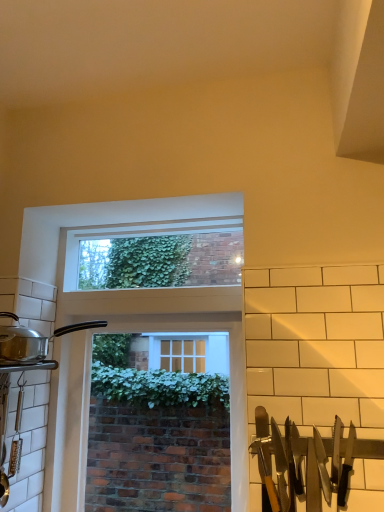
What do you see at coordinates (161, 260) in the screenshot? This screenshot has width=384, height=512. I see `clear glass window at upper center, acting as the 2th window screen starting from the bottom` at bounding box center [161, 260].

Identify the location of clear glass window at center, the 2th window screen viewed from the top. (155, 433).

You are a GUI agent. You are given a task and a screenshot of the screen. Output one action in this format:
    pyautogui.click(x=<x>, y=<y>)
    Task: Click on the silver/black handles at right
    The image size is (384, 512).
    Given the screenshot: What is the action you would take?
    pyautogui.click(x=301, y=463)

Find the location of a particular element. This screenshot has height=512, width=384. silver metallic pot at left is located at coordinates (33, 342).

What are the coordinates of `clear glass window at upper center, which appears as the 1th window screen when viewed from the top` in the screenshot? It's located at (161, 260).

Between clear glass window at upper center, acting as the 2th window screen starting from the bottom, and silver/black handles at right, which one is positioned in front?

Positioned in front is silver/black handles at right.

From a real-world perspective, which object stands above the other?

From a 3D spatial view, clear glass window at upper center, acting as the 2th window screen starting from the bottom, is above.

Considering the sizes of objects clear glass window at upper center, which appears as the 1th window screen when viewed from the top, and silver/black handles at right in the image provided, who is wider, clear glass window at upper center, which appears as the 1th window screen when viewed from the top, or silver/black handles at right?

Wider between the two is clear glass window at upper center, which appears as the 1th window screen when viewed from the top.

Which is more to the left, silver/black handles at right or silver metallic pot at left?

From the viewer's perspective, silver metallic pot at left appears more on the left side.

Is silver/black handles at right taller than silver metallic pot at left?

Correct, silver/black handles at right is much taller as silver metallic pot at left.

Could you tell me if silver/black handles at right is turned towards silver metallic pot at left?

No, silver/black handles at right is not turned towards silver metallic pot at left.

How different are the orientations of clear glass window at center, the first window screen from the bottom, and silver metallic pot at left in degrees?

91.3 degrees.

Does point (135, 509) appear closer or farther from the camera than point (42, 354)?

Point (135, 509) is farther from the camera than point (42, 354).

From the picture: Considering the sizes of objects clear glass window at center, the 2th window screen viewed from the top, and silver metallic pot at left in the image provided, who is shorter, clear glass window at center, the 2th window screen viewed from the top, or silver metallic pot at left?

silver metallic pot at left.

Does clear glass window at center, the 2th window screen viewed from the top, turn towards silver metallic pot at left?

Yes, clear glass window at center, the 2th window screen viewed from the top, is facing silver metallic pot at left.

Is silver metallic pot at left wider than silver/black handles at right?

Correct, the width of silver metallic pot at left exceeds that of silver/black handles at right.

Is silver metallic pot at left bigger than silver/black handles at right?

Yes, silver metallic pot at left is bigger than silver/black handles at right.

From the image's perspective, is silver metallic pot at left located above silver/black handles at right?

Yes.

Considering the points (5, 343) and (337, 450), which point is in front, point (5, 343) or point (337, 450)?

The point (337, 450) is in front.

How different are the orientations of silver/black handles at right and clear glass window at center, the 2th window screen viewed from the top, in degrees?

1.38 degrees.

Consider the image. Is silver/black handles at right shorter than clear glass window at center, the first window screen from the bottom?

Yes, silver/black handles at right is shorter than clear glass window at center, the first window screen from the bottom.

Could you tell me if silver/black handles at right is turned towards clear glass window at center, the first window screen from the bottom?

No, silver/black handles at right is not facing towards clear glass window at center, the first window screen from the bottom.

Considering the sizes of objects silver/black handles at right and clear glass window at center, the first window screen from the bottom, in the image provided, who is bigger, silver/black handles at right or clear glass window at center, the first window screen from the bottom,?

Bigger between the two is clear glass window at center, the first window screen from the bottom.

Is clear glass window at center, the first window screen from the bottom, further to camera compared to clear glass window at upper center, which appears as the 1th window screen when viewed from the top?

No, it is not.

Is clear glass window at upper center, acting as the 2th window screen starting from the bottom, inside clear glass window at center, the first window screen from the bottom?

No, clear glass window at center, the first window screen from the bottom, does not contain clear glass window at upper center, acting as the 2th window screen starting from the bottom.

Based on their positions, is clear glass window at center, the 2th window screen viewed from the top, located to the left or right of clear glass window at upper center, acting as the 2th window screen starting from the bottom?

clear glass window at center, the 2th window screen viewed from the top, is to the right of clear glass window at upper center, acting as the 2th window screen starting from the bottom.

Considering the points (187, 441) and (226, 248), which point is behind, point (187, 441) or point (226, 248)?

The point (187, 441) is farther from the camera.

Can you confirm if silver metallic pot at left is wider than clear glass window at center, the 2th window screen viewed from the top?

Yes.

Is silver metallic pot at left positioned with its back to clear glass window at center, the first window screen from the bottom?

That's not correct — silver metallic pot at left is not looking away from clear glass window at center, the first window screen from the bottom.

Is clear glass window at center, the first window screen from the bottom, completely or partially inside silver metallic pot at left?

No.

Where is `silverware located in front of the clear glass window at upper center, acting as the 2th window screen starting from the bottom`? silverware located in front of the clear glass window at upper center, acting as the 2th window screen starting from the bottom is located at coordinates (301, 463).

The image size is (384, 512). I want to click on kitchen appliance above the silver/black handles at right (from a real-world perspective), so click(33, 342).

When comparing their distances from clear glass window at center, the 2th window screen viewed from the top, does clear glass window at upper center, acting as the 2th window screen starting from the bottom, or silver metallic pot at left seem further?

Among the two, silver metallic pot at left is located further to clear glass window at center, the 2th window screen viewed from the top.

Considering their positions, is clear glass window at upper center, acting as the 2th window screen starting from the bottom, positioned further to silver metallic pot at left than silver/black handles at right?

silver/black handles at right is positioned further to the anchor silver metallic pot at left.

Looking at the image, which one is located further to silver metallic pot at left, clear glass window at center, the first window screen from the bottom, or silver/black handles at right?

clear glass window at center, the first window screen from the bottom, is positioned further to the anchor silver metallic pot at left.

From the picture: Considering their positions, is clear glass window at center, the first window screen from the bottom, positioned further to silver/black handles at right than clear glass window at upper center, acting as the 2th window screen starting from the bottom?

Based on the image, clear glass window at center, the first window screen from the bottom, appears to be further to silver/black handles at right.

Based on their spatial positions, is silver/black handles at right or clear glass window at center, the 2th window screen viewed from the top, closer to clear glass window at upper center, which appears as the 1th window screen when viewed from the top?

The object closer to clear glass window at upper center, which appears as the 1th window screen when viewed from the top, is silver/black handles at right.

Considering their positions, is clear glass window at upper center, acting as the 2th window screen starting from the bottom, positioned further to silver/black handles at right than silver metallic pot at left?

Among the two, silver metallic pot at left is located further to silver/black handles at right.

Which object lies nearer to the anchor point silver/black handles at right, silver metallic pot at left or clear glass window at upper center, acting as the 2th window screen starting from the bottom?

Based on the image, clear glass window at upper center, acting as the 2th window screen starting from the bottom, appears to be nearer to silver/black handles at right.

Based on their spatial positions, is clear glass window at center, the first window screen from the bottom, or silver/black handles at right closer to clear glass window at upper center, acting as the 2th window screen starting from the bottom?

silver/black handles at right is closer to clear glass window at upper center, acting as the 2th window screen starting from the bottom.

Identify the location of kitchen appliance between clear glass window at upper center, acting as the 2th window screen starting from the bottom, and clear glass window at center, the 2th window screen viewed from the top, from top to bottom. This screenshot has height=512, width=384. (33, 342).

At what (x,y) coordinates should I click in order to perform the action: click on window screen that lies between clear glass window at upper center, which appears as the 1th window screen when viewed from the top, and silver/black handles at right from top to bottom. Please return your answer as a coordinate pair (x, y). The height and width of the screenshot is (512, 384). Looking at the image, I should click on pos(155,433).